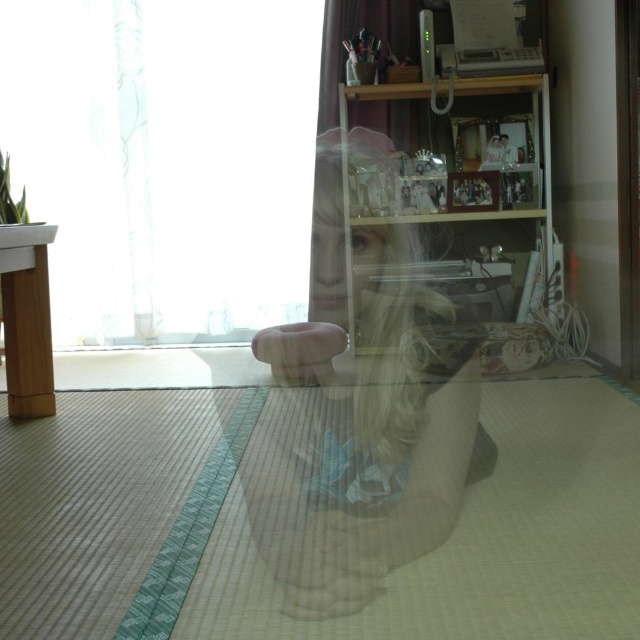
Question: Is blonde hair at center wider than transparent wood table at left?

Choices:
 (A) yes
 (B) no

Answer: (A)

Question: Which point is closer to the camera taking this photo?

Choices:
 (A) (346, 234)
 (B) (13, 228)

Answer: (B)

Question: In this image, where is blonde hair at center located relative to transparent glass door at right?

Choices:
 (A) below
 (B) above

Answer: (A)

Question: Can you confirm if blonde hair at center is thinner than transparent wood table at left?

Choices:
 (A) yes
 (B) no

Answer: (B)

Question: Which object appears farthest from the camera in this image?

Choices:
 (A) transparent wood table at left
 (B) transparent glass door at right
 (C) green bamboo mat at lower center

Answer: (B)

Question: Which point is closer to the camera?

Choices:
 (A) green bamboo mat at lower center
 (B) transparent glass shelf at upper center

Answer: (A)